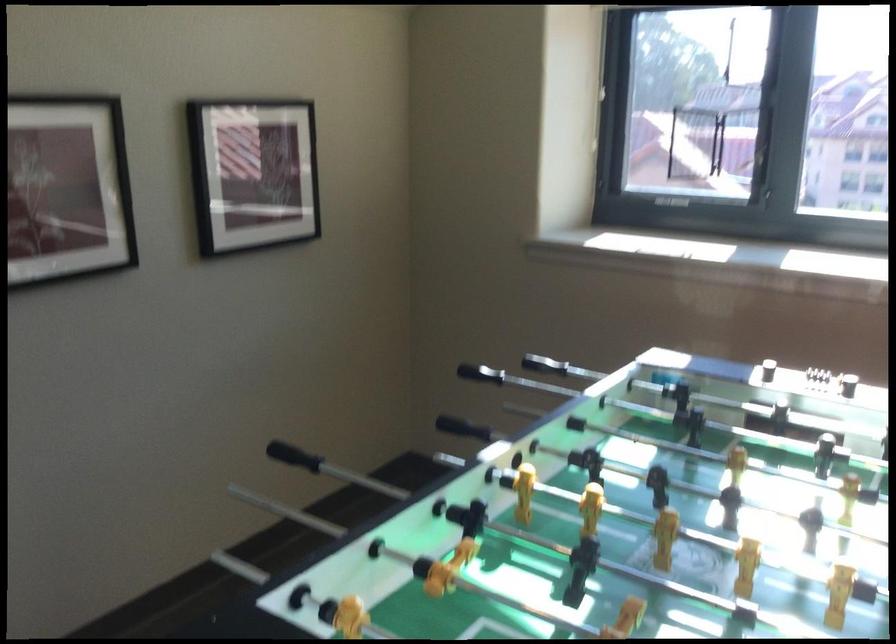
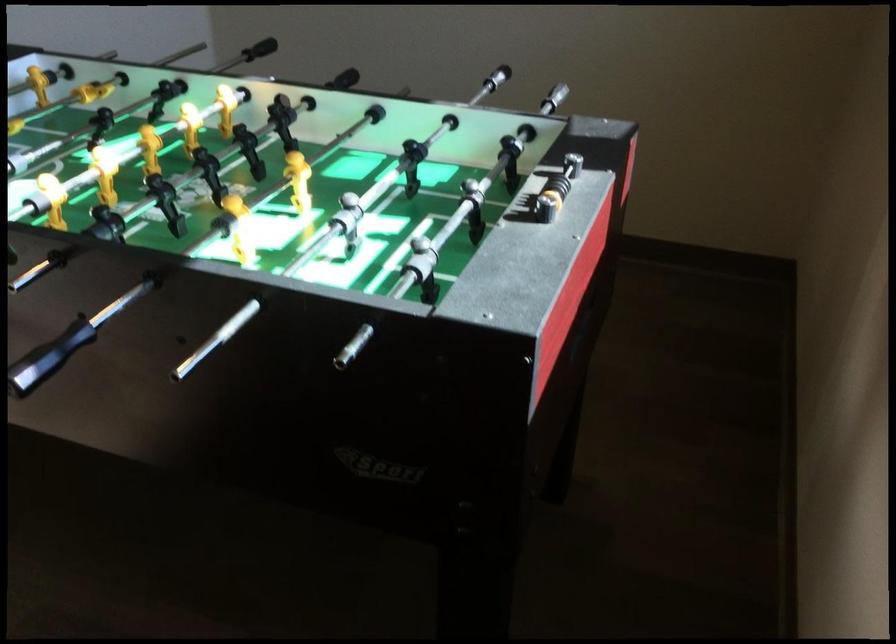
Find the pixel in the second image that matches (184,422) in the first image.

(496, 78)